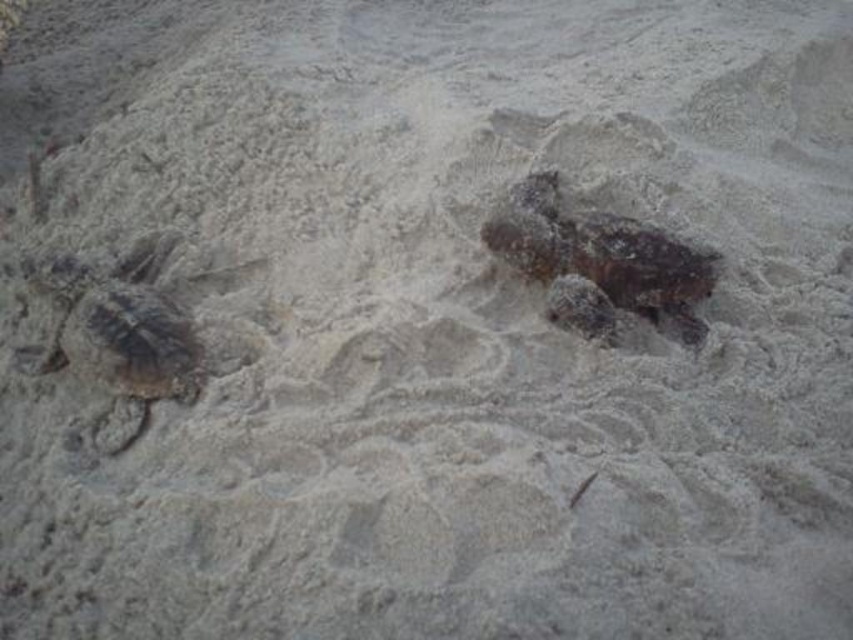
Question: Is dark brown textured turtle at left further to camera compared to dark brown textured turtle at center?

Choices:
 (A) no
 (B) yes

Answer: (A)

Question: Is dark brown textured turtle at left above dark brown textured turtle at center?

Choices:
 (A) no
 (B) yes

Answer: (A)

Question: Which point is farther from the camera taking this photo?

Choices:
 (A) (109, 291)
 (B) (614, 296)

Answer: (A)

Question: Among these points, which one is farthest from the camera?

Choices:
 (A) (595, 321)
 (B) (119, 323)

Answer: (B)

Question: Is dark brown textured turtle at left smaller than dark brown textured turtle at center?

Choices:
 (A) no
 (B) yes

Answer: (A)

Question: Among these objects, which one is farthest from the camera?

Choices:
 (A) dark brown textured turtle at center
 (B) dark brown textured turtle at left

Answer: (A)